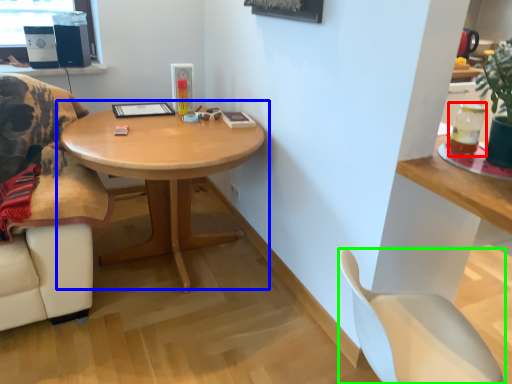
Question: Based on their relative distances, which object is farther from beverage (highlighted by a red box)? Choose from coffee table (highlighted by a blue box) and chair (highlighted by a green box).

Choices:
 (A) coffee table
 (B) chair

Answer: (A)